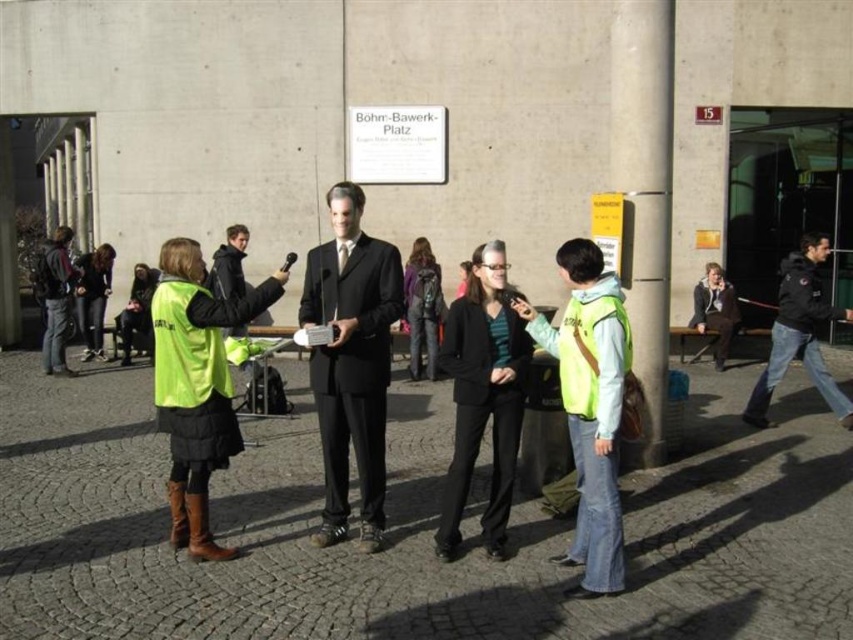
You are a photographer standing in front of the B?hm Bawerk Platz building. You notice the reflective yellow vest at center and the black leather jacket at right. Which object is closer to the camera?

The reflective yellow vest at center is positioned under the black leather jacket at right, meaning it is closer to the camera.